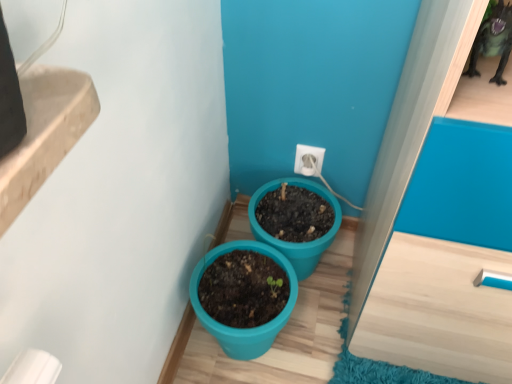
Question: Considering their positions, is white plastic electric outlet at center located in front of or behind teal plastic pot at lower center, the first flowerpot when ordered from right to left?

Choices:
 (A) front
 (B) behind

Answer: (B)

Question: Considering the positions of white plastic electric outlet at center and teal plastic pot at lower center, which is the second flowerpot in left-to-right order, in the image, is white plastic electric outlet at center wider or thinner than teal plastic pot at lower center, which is the second flowerpot in left-to-right order,?

Choices:
 (A) thin
 (B) wide

Answer: (A)

Question: Which object is the closest to the teal plastic pot at center, which appears as the 2th flowerpot when viewed from the right?

Choices:
 (A) white plastic electric outlet at center
 (B) teal plastic pot at lower center, the first flowerpot when ordered from right to left

Answer: (B)

Question: Which object is the closest to the white plastic electric outlet at center?

Choices:
 (A) teal plastic pot at lower center, the first flowerpot when ordered from right to left
 (B) teal plastic pot at center, which appears as the 2th flowerpot when viewed from the right

Answer: (A)